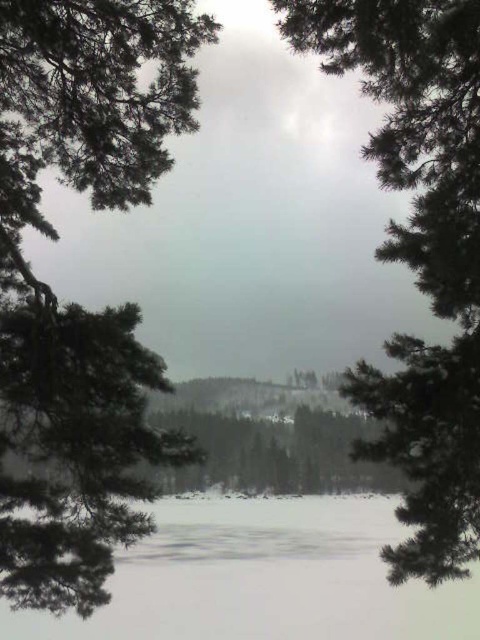
Does green matte tree at upper left have a greater height compared to white ice at center?

Indeed, green matte tree at upper left has a greater height compared to white ice at center.

Image resolution: width=480 pixels, height=640 pixels. What are the coordinates of `green matte tree at upper left` in the screenshot? It's located at (420, 253).

This screenshot has width=480, height=640. Describe the element at coordinates (420, 253) in the screenshot. I see `green matte tree at upper left` at that location.

This screenshot has height=640, width=480. In order to click on green matte tree at upper left in this screenshot , I will do `click(420, 253)`.

Is green needle-like leaves at left bigger than white ice at center?

Correct, green needle-like leaves at left is larger in size than white ice at center.

Is green needle-like leaves at left above white ice at center?

Yes, green needle-like leaves at left is above white ice at center.

Identify the location of green needle-like leaves at left. This screenshot has width=480, height=640. (75, 304).

Who is positioned more to the right, green needle-like leaves at left or green matte tree at upper left?

green matte tree at upper left

Is green needle-like leaves at left bigger than green matte tree at upper left?

No.

Does point (78, 177) come farther from viewer compared to point (433, 456)?

Yes, it is.

What are the coordinates of `green needle-like leaves at left` in the screenshot? It's located at (75, 304).